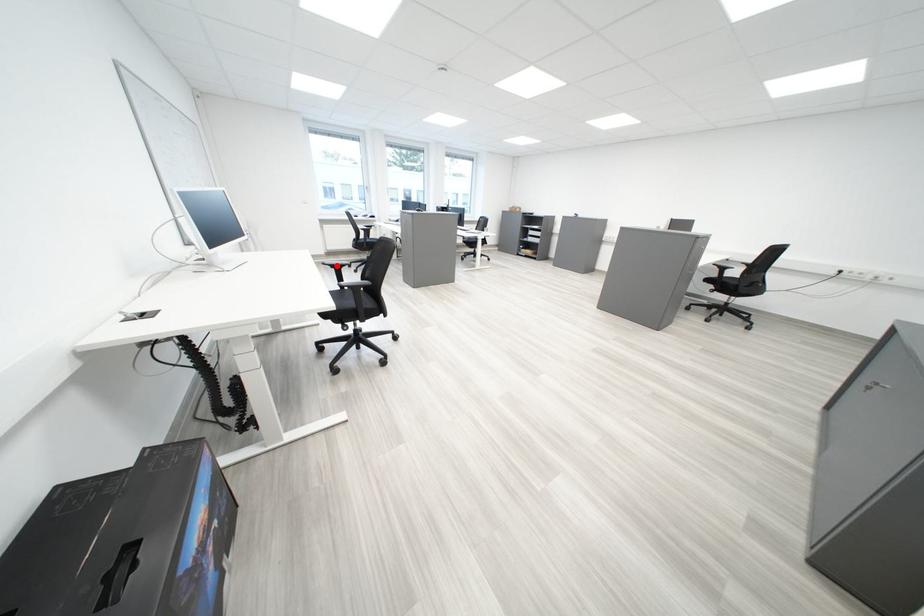
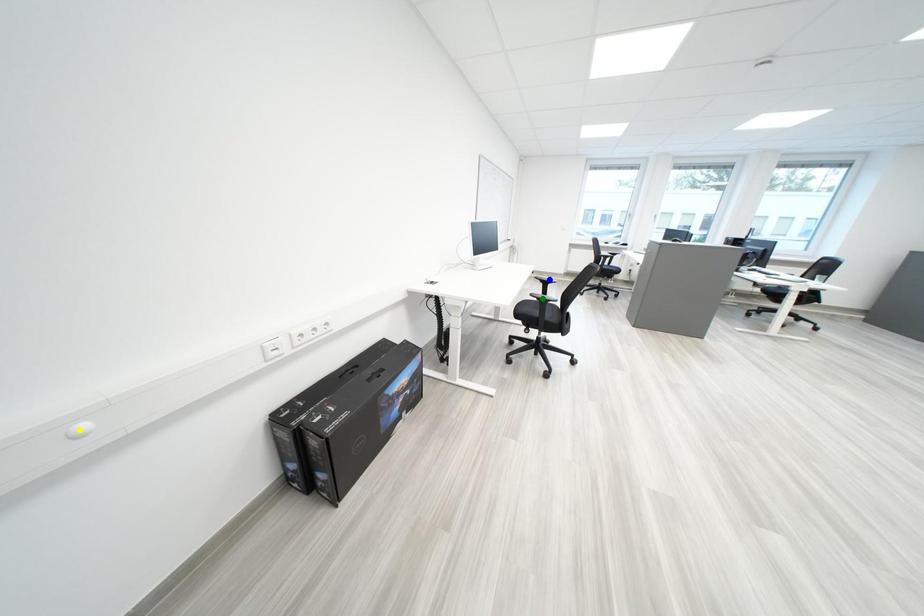
Question: I am providing you with two images of the same scene from different viewpoints. A red point is marked on the first image. You are given multiple points on the second image. Which spot in image 2 lines up with the point in image 1?

Choices:
 (A) blue point
 (B) yellow point
 (C) green point

Answer: (A)